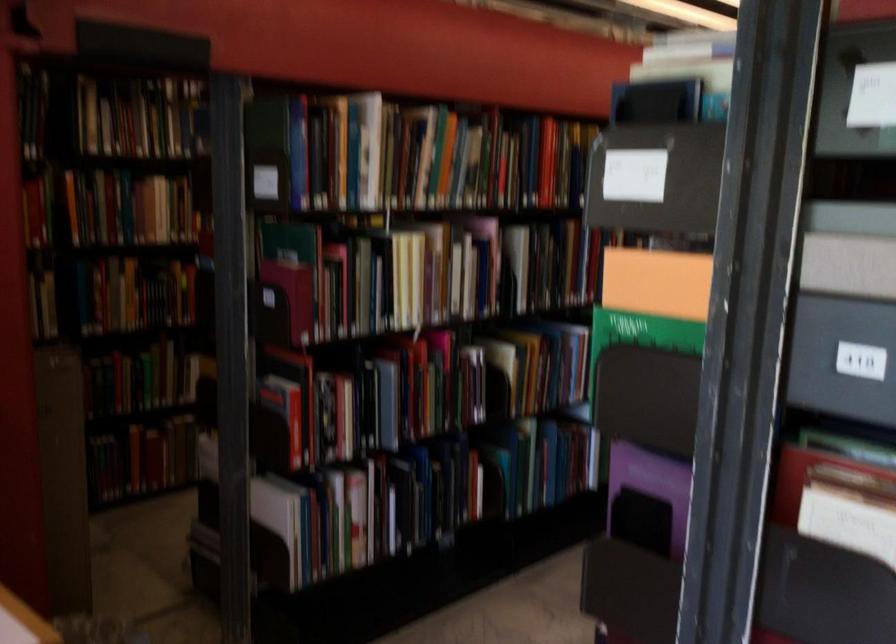
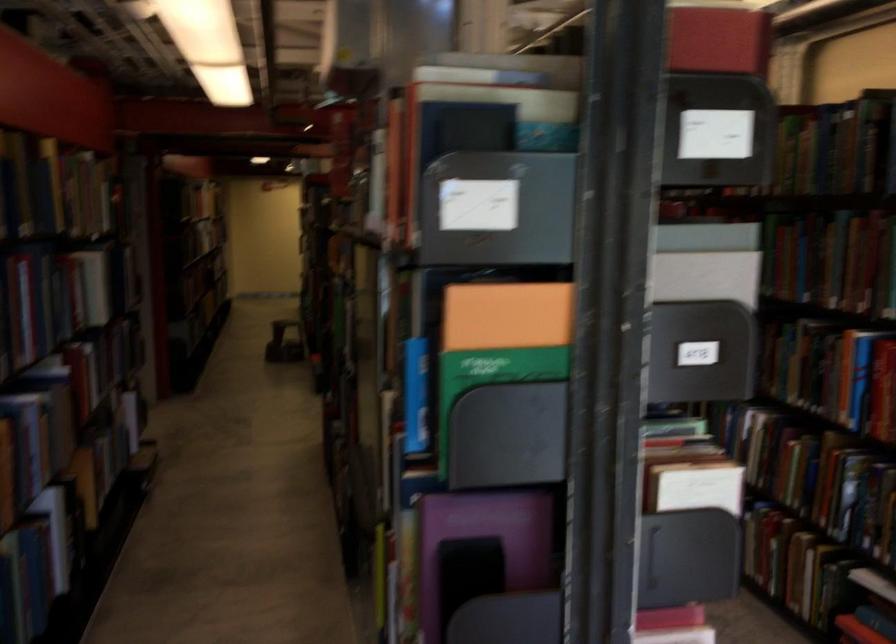
Find the pixel in the second image that matches point 648,350 in the first image.

(416, 395)